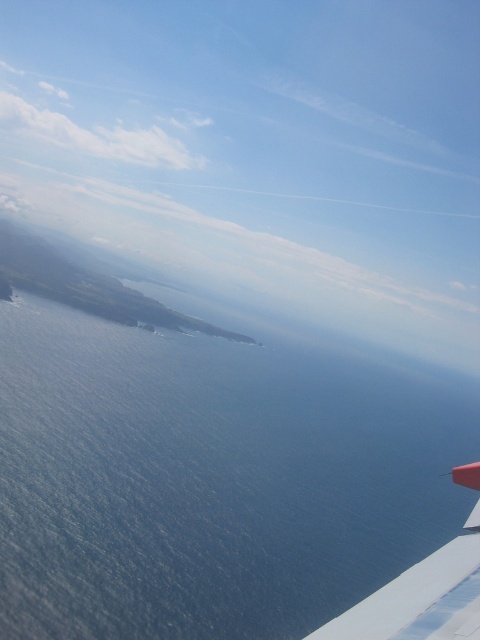
You are a pilot flying over the ocean and need to determine the visibility of the blue water at lower left and the white matte wing at lower right for a navigation report. Which object occupies a bigger area in the image?

The blue water at lower left has a larger size compared to the white matte wing at lower right, so the blue water at lower left occupies a bigger area in the image.

You are a passenger on an airplane and looking out the window. You see the blue water at lower left and the white matte wing at lower right. Which object is closer to the left edge of the window?

The blue water at lower left is closer to the left edge of the window because it is positioned on the left side of the white matte wing at lower right.